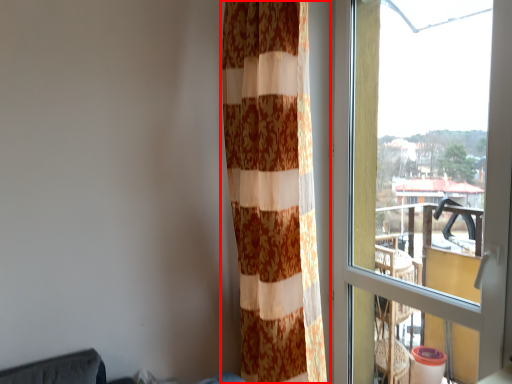
Question: From the image's perspective, where is curtain (annotated by the red box) located relative to window?

Choices:
 (A) above
 (B) below

Answer: (A)